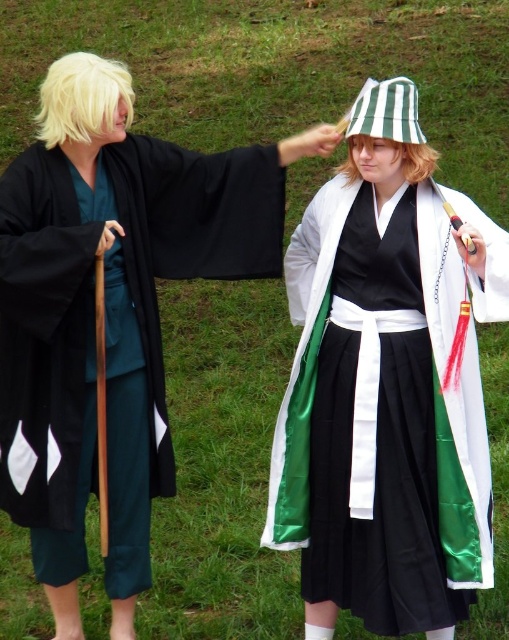
Question: Based on their relative distances, which object is nearer to the green striped fabric bucket hat at upper center?

Choices:
 (A) black satin robe at left
 (B) green satin kimono at center

Answer: (B)

Question: Estimate the real-world distances between objects in this image. Which object is closer to the black satin robe at left?

Choices:
 (A) green satin kimono at center
 (B) green striped fabric bucket hat at upper center

Answer: (A)

Question: Is green satin kimono at center closer to camera compared to green striped fabric bucket hat at upper center?

Choices:
 (A) no
 (B) yes

Answer: (B)

Question: Based on their relative distances, which object is nearer to the green striped fabric bucket hat at upper center?

Choices:
 (A) black satin robe at left
 (B) green satin kimono at center

Answer: (B)

Question: Is green satin kimono at center to the right of green striped fabric bucket hat at upper center from the viewer's perspective?

Choices:
 (A) yes
 (B) no

Answer: (B)

Question: Is black satin robe at left bigger than green striped fabric bucket hat at upper center?

Choices:
 (A) no
 (B) yes

Answer: (B)